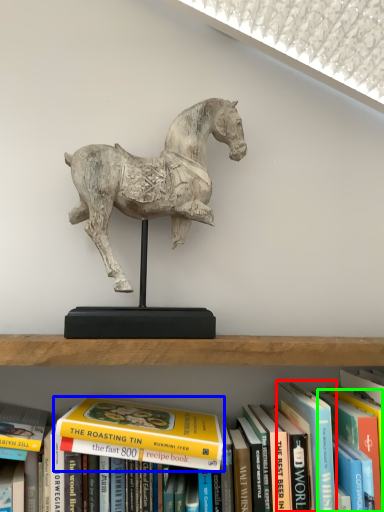
Question: Estimate the real-world distances between objects in this image. Which object is closer to paperback book (highlighted by a red box), book (highlighted by a blue box) or paperback book (highlighted by a green box)?

Choices:
 (A) book
 (B) paperback book

Answer: (B)